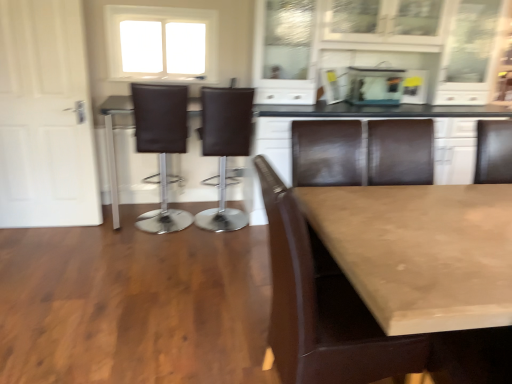
I want to click on free space in front of white matte door at left, so click(44, 254).